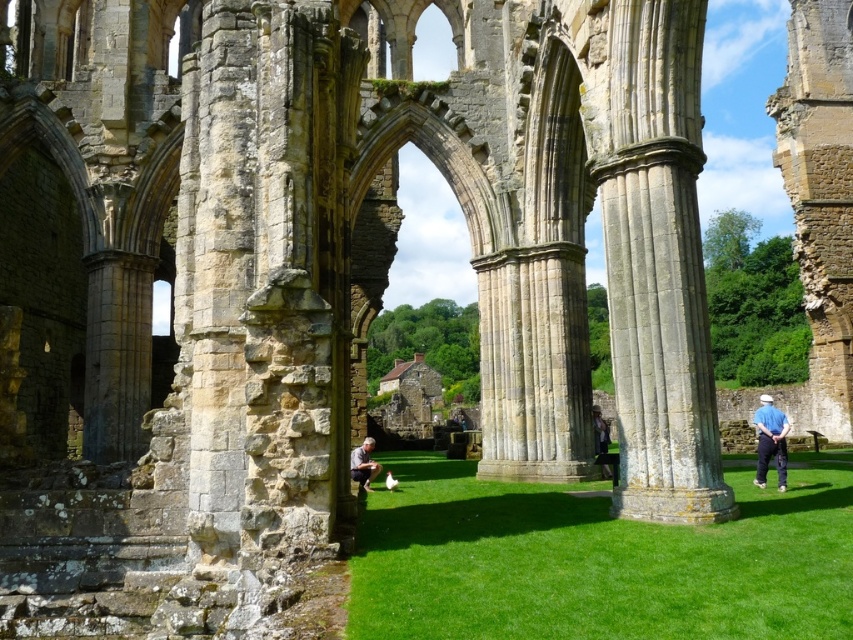
You are standing at the point with coordinates of 0.5, 0.5. You want to walk to the stone column at center. In which direction should you move?

You should move towards the southwest direction to reach the stone column at center located at point (659, 268) from your current position at (426, 320).

You are planning to place a 10 meter long decorative fence between the green grass at center and the stone column at center. Will the fence fit exactly between them without overlapping either object?

The distance between the green grass at center and the stone column at center is 12.69 meters, so a 10 meter long fence would fit between them with 2.69 meters of space remaining on either side.